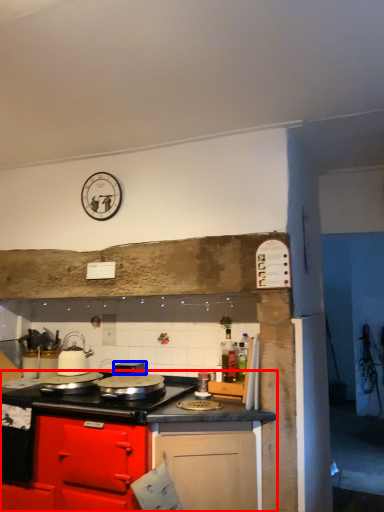
Question: Which object appears closest to the camera in this image, cabinetry (highlighted by a red box) or appliance (highlighted by a blue box)?

Choices:
 (A) cabinetry
 (B) appliance

Answer: (A)